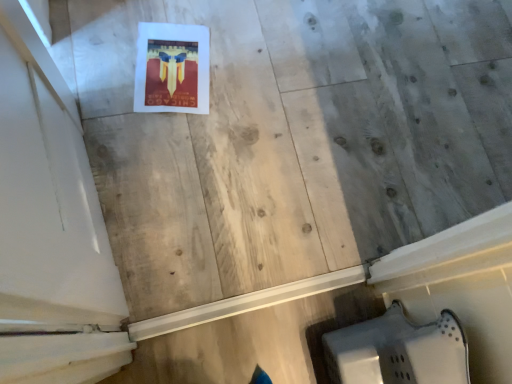
Where is `free point to the right of white matte door at upper left`? The height and width of the screenshot is (384, 512). free point to the right of white matte door at upper left is located at coordinates (217, 216).